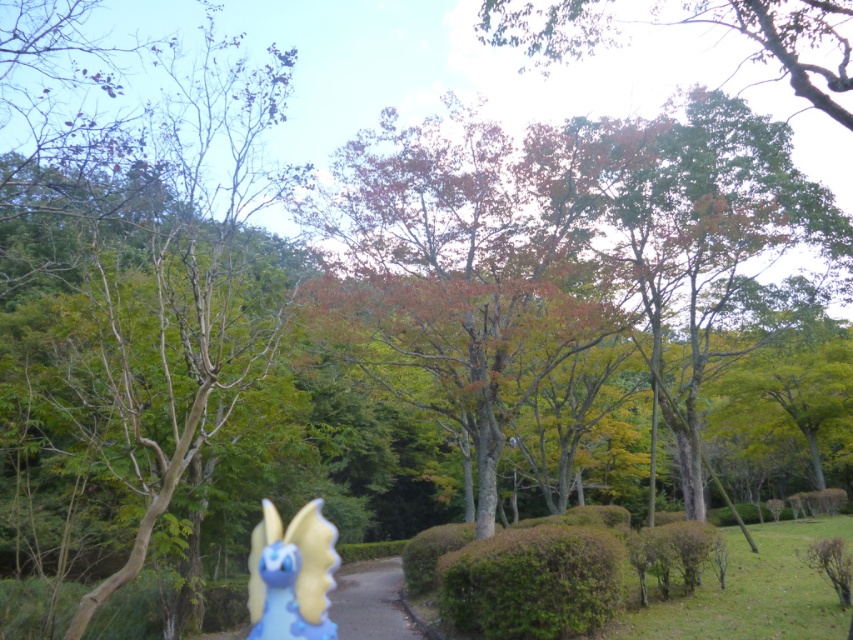
Can you confirm if brown matte tree at left is shorter than blue matte figurine at lower left?

Incorrect, brown matte tree at left's height does not fall short of blue matte figurine at lower left's.

Can you confirm if brown matte tree at left is smaller than blue matte figurine at lower left?

Actually, brown matte tree at left might be larger than blue matte figurine at lower left.

Between point (245, 296) and point (283, 636), which one is positioned behind?

The point (245, 296) is more distant.

At what (x,y) coordinates should I click in order to perform the action: click on brown matte tree at left. Please return your answer as a coordinate pair (x, y). This screenshot has width=853, height=640. Looking at the image, I should click on (169, 260).

Is point (195, 292) positioned in front of point (720, 573)?

Yes, it is in front of point (720, 573).

Can you confirm if brown matte tree at left is positioned below green textured hedge at center?

Actually, brown matte tree at left is above green textured hedge at center.

Is point (247, 182) positioned behind point (463, 596)?

No, (247, 182) is closer to viewer.

Image resolution: width=853 pixels, height=640 pixels. I want to click on brown matte tree at left, so click(169, 260).

Is green textured hedge at center in front of blue matte figurine at lower left?

That is False.

Can you confirm if green textured hedge at center is taller than blue matte figurine at lower left?

Indeed, green textured hedge at center has a greater height compared to blue matte figurine at lower left.

Between point (494, 563) and point (276, 524), which one is positioned behind?

The point (494, 563) is more distant.

Image resolution: width=853 pixels, height=640 pixels. What are the coordinates of `green textured hedge at center` in the screenshot? It's located at (546, 570).